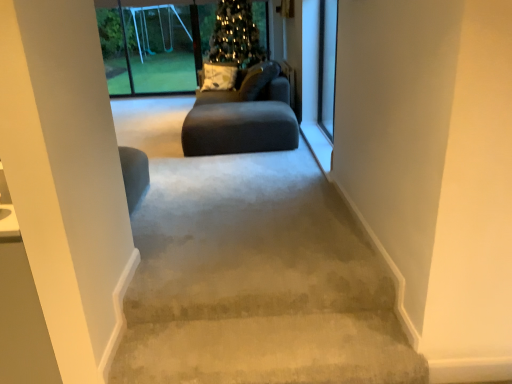
What is the approximate height of transparent plastic swing set at upper left, the 1th screen door positioned from the back?

5.09 feet.

Describe the element at coordinates (252, 86) in the screenshot. I see `dark gray fabric couch at center` at that location.

Where is `transparent plastic swing set at upper left, which is the 2th screen door in bottom-to-top order`? The height and width of the screenshot is (384, 512). transparent plastic swing set at upper left, which is the 2th screen door in bottom-to-top order is located at coordinates (160, 49).

Based on the photo, from the image's perspective, is matte gray couch at center under clear glass screen door at upper right, the first screen door from the right?

Indeed, from the image's perspective, matte gray couch at center is shown beneath clear glass screen door at upper right, the first screen door from the right.

Who is bigger, matte gray couch at center or clear glass screen door at upper right, the second screen door in the top-to-bottom sequence?

Bigger between the two is matte gray couch at center.

Is matte gray couch at center aimed at clear glass screen door at upper right, which is the 2th screen door from left to right?

No, matte gray couch at center is not facing towards clear glass screen door at upper right, which is the 2th screen door from left to right.

Is matte gray couch at center positioned far away from clear glass screen door at upper right, which is counted as the second screen door, starting from the back?

They are positioned close to each other.

Does matte gray couch at center lie in front of dark gray fabric couch at center?

That is True.

From a real-world perspective, which is physically below, matte gray couch at center or dark gray fabric couch at center?

In real-world perspective, matte gray couch at center is lower.

Considering the relative sizes of matte gray couch at center and dark gray fabric couch at center in the image provided, is matte gray couch at center taller than dark gray fabric couch at center?

In fact, matte gray couch at center may be shorter than dark gray fabric couch at center.

From the image's perspective, is matte gray couch at center under dark gray fabric couch at center?

Yes.

Looking at this image, from the image's perspective, who appears lower, dark gray fabric couch at center or clear glass screen door at upper right, which appears as the 1th screen door when ordered from the bottom?

clear glass screen door at upper right, which appears as the 1th screen door when ordered from the bottom, appears lower in the image.

Which is correct: dark gray fabric couch at center is inside clear glass screen door at upper right, the first screen door from the right, or outside of it?

dark gray fabric couch at center is outside clear glass screen door at upper right, the first screen door from the right.

In terms of height, does dark gray fabric couch at center look taller or shorter compared to clear glass screen door at upper right, the first screen door from the right?

In the image, dark gray fabric couch at center appears to be shorter than clear glass screen door at upper right, the first screen door from the right.

Is dark gray fabric couch at center positioned behind clear glass screen door at upper right, which is the 2th screen door from left to right?

Yes, it is.

From the image's perspective, is dark gray fabric couch at center under transparent plastic swing set at upper left, the 1th screen door positioned from the back?

Yes, from the image's perspective, dark gray fabric couch at center is below transparent plastic swing set at upper left, the 1th screen door positioned from the back.

Is transparent plastic swing set at upper left, the first screen door when ordered from left to right, completely or partially inside dark gray fabric couch at center?

No, transparent plastic swing set at upper left, the first screen door when ordered from left to right, is located outside of dark gray fabric couch at center.

In terms of width, does dark gray fabric couch at center look wider or thinner when compared to transparent plastic swing set at upper left, which appears as the 2th screen door when viewed from the front?

Clearly, dark gray fabric couch at center has more width compared to transparent plastic swing set at upper left, which appears as the 2th screen door when viewed from the front.

Is point (258, 76) closer to camera compared to point (142, 86)?

Yes, point (258, 76) is closer to viewer.

Are transparent plastic swing set at upper left, the first screen door when ordered from left to right, and clear glass screen door at upper right, the first screen door from the right, located far from each other?

transparent plastic swing set at upper left, the first screen door when ordered from left to right, is positioned a significant distance from clear glass screen door at upper right, the first screen door from the right.

In terms of width, does transparent plastic swing set at upper left, the first screen door when ordered from left to right, look wider or thinner when compared to clear glass screen door at upper right, the first screen door from the right?

Considering their sizes, transparent plastic swing set at upper left, the first screen door when ordered from left to right, looks broader than clear glass screen door at upper right, the first screen door from the right.

From a real-world perspective, is transparent plastic swing set at upper left, the first screen door when ordered from left to right, positioned above or below clear glass screen door at upper right, which is counted as the second screen door, starting from the back?

transparent plastic swing set at upper left, the first screen door when ordered from left to right, is situated higher than clear glass screen door at upper right, which is counted as the second screen door, starting from the back, in the real world.

Which of these two, transparent plastic swing set at upper left, the first screen door when ordered from top to bottom, or clear glass screen door at upper right, the second screen door in the top-to-bottom sequence, is smaller?

With smaller size is clear glass screen door at upper right, the second screen door in the top-to-bottom sequence.

Is dark gray fabric couch at center positioned in front of matte gray couch at center?

That is False.

Can you confirm if dark gray fabric couch at center is positioned to the left of matte gray couch at center?

Correct, you'll find dark gray fabric couch at center to the left of matte gray couch at center.

Considering the relative sizes of dark gray fabric couch at center and matte gray couch at center in the image provided, is dark gray fabric couch at center taller than matte gray couch at center?

Indeed, dark gray fabric couch at center has a greater height compared to matte gray couch at center.

Is transparent plastic swing set at upper left, the 1th screen door positioned from the back, aimed at matte gray couch at center?

Yes, transparent plastic swing set at upper left, the 1th screen door positioned from the back, is oriented towards matte gray couch at center.

In the scene shown: How many degrees apart are the facing directions of transparent plastic swing set at upper left, the first screen door when ordered from top to bottom, and matte gray couch at center?

They differ by 88.7 degrees in their facing directions.

Can you confirm if transparent plastic swing set at upper left, the 1th screen door positioned from the back, is positioned to the left of matte gray couch at center?

Correct, you'll find transparent plastic swing set at upper left, the 1th screen door positioned from the back, to the left of matte gray couch at center.

Can you confirm if transparent plastic swing set at upper left, which appears as the 2th screen door when viewed from the front, is thinner than matte gray couch at center?

Correct, the width of transparent plastic swing set at upper left, which appears as the 2th screen door when viewed from the front, is less than that of matte gray couch at center.

Find the location of `screen door on the right side of matte gray couch at center`. screen door on the right side of matte gray couch at center is located at coordinates (327, 65).

The image size is (512, 384). In order to click on couch above the matte gray couch at center (from the image's perspective) in this screenshot , I will do (x=252, y=86).

When comparing their distances from clear glass screen door at upper right, the first screen door from the right, does dark gray fabric couch at center or transparent plastic swing set at upper left, the 2th screen door in the right-to-left sequence, seem further?

Based on the image, transparent plastic swing set at upper left, the 2th screen door in the right-to-left sequence, appears to be further to clear glass screen door at upper right, the first screen door from the right.

Considering their positions, is clear glass screen door at upper right, the first screen door from the right, positioned closer to dark gray fabric couch at center than transparent plastic swing set at upper left, the 1th screen door positioned from the back?

clear glass screen door at upper right, the first screen door from the right.

Which object lies nearer to the anchor point dark gray fabric couch at center, matte gray couch at center or clear glass screen door at upper right, the second screen door in the top-to-bottom sequence?

matte gray couch at center.

Considering their positions, is matte gray couch at center positioned further to clear glass screen door at upper right, which appears as the 1th screen door when ordered from the bottom, than transparent plastic swing set at upper left, the 1th screen door positioned from the back?

transparent plastic swing set at upper left, the 1th screen door positioned from the back, is positioned further to the anchor clear glass screen door at upper right, which appears as the 1th screen door when ordered from the bottom.

Which object lies further to the anchor point dark gray fabric couch at center, transparent plastic swing set at upper left, which appears as the 2th screen door when viewed from the front, or clear glass screen door at upper right, which is counted as the second screen door, starting from the back?

transparent plastic swing set at upper left, which appears as the 2th screen door when viewed from the front, is positioned further to the anchor dark gray fabric couch at center.

From the image, which object appears to be nearer to transparent plastic swing set at upper left, the 1th screen door positioned from the back, matte gray couch at center or dark gray fabric couch at center?

dark gray fabric couch at center lies closer to transparent plastic swing set at upper left, the 1th screen door positioned from the back, than the other object.

Estimate the real-world distances between objects in this image. Which object is closer to matte gray couch at center, dark gray fabric couch at center or clear glass screen door at upper right, which is the 2th screen door from left to right?

The object closer to matte gray couch at center is dark gray fabric couch at center.

Estimate the real-world distances between objects in this image. Which object is closer to transparent plastic swing set at upper left, the first screen door when ordered from top to bottom, matte gray couch at center or clear glass screen door at upper right, which is counted as the second screen door, starting from the back?

Based on the image, matte gray couch at center appears to be nearer to transparent plastic swing set at upper left, the first screen door when ordered from top to bottom.

Find the location of a particular element. The height and width of the screenshot is (384, 512). couch between clear glass screen door at upper right, which appears as the 1th screen door when ordered from the bottom, and transparent plastic swing set at upper left, which appears as the 2th screen door when viewed from the front, along the z-axis is located at coordinates (252, 86).

This screenshot has width=512, height=384. Find the location of `studio couch between dark gray fabric couch at center and clear glass screen door at upper right, the first screen door from the right`. studio couch between dark gray fabric couch at center and clear glass screen door at upper right, the first screen door from the right is located at coordinates (243, 117).

Find the location of a particular element. This screenshot has height=384, width=512. studio couch between clear glass screen door at upper right, which appears as the 1th screen door when ordered from the bottom, and transparent plastic swing set at upper left, which appears as the 2th screen door when viewed from the front, from front to back is located at coordinates (243, 117).

The height and width of the screenshot is (384, 512). What are the coordinates of `couch between matte gray couch at center and transparent plastic swing set at upper left, the 2th screen door in the right-to-left sequence, along the z-axis` in the screenshot? It's located at (252, 86).